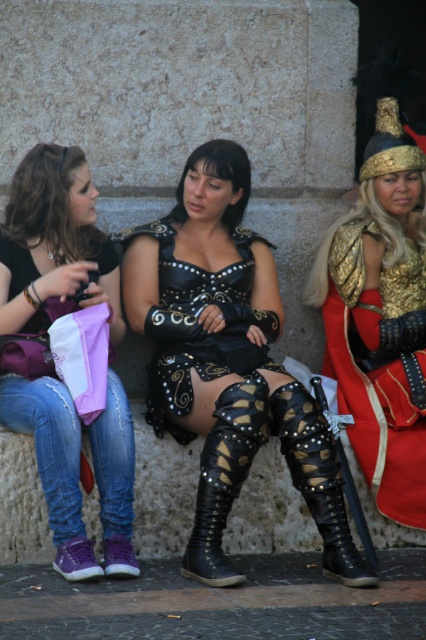
Which is above, leather/embossed boots at center or gold metallic armor at right?

Positioned higher is gold metallic armor at right.

Which of these two, leather/embossed boots at center or gold metallic armor at right, stands taller?

With more height is gold metallic armor at right.

Where is `leather/embossed boots at center`? The image size is (426, 640). leather/embossed boots at center is located at coordinates (227, 360).

Locate an element on the screen. The width and height of the screenshot is (426, 640). leather/embossed boots at center is located at coordinates (227, 360).

Can you confirm if denim jeans at lower left is positioned above leather/golden studs boot at center?

Correct, denim jeans at lower left is located above leather/golden studs boot at center.

Can you confirm if denim jeans at lower left is positioned below leather/golden studs boot at center?

Incorrect, denim jeans at lower left is not positioned below leather/golden studs boot at center.

Describe the element at coordinates (54, 243) in the screenshot. I see `denim jeans at lower left` at that location.

In order to click on denim jeans at lower left in this screenshot , I will do `click(54, 243)`.

Looking at this image, is gold metallic armor at right wider than leather/golden studs boot at center?

Indeed, gold metallic armor at right has a greater width compared to leather/golden studs boot at center.

Is point (403, 340) farther from viewer compared to point (294, 465)?

Yes, it is behind point (294, 465).

Where is `gold metallic armor at right`? This screenshot has height=640, width=426. gold metallic armor at right is located at coordinates (380, 317).